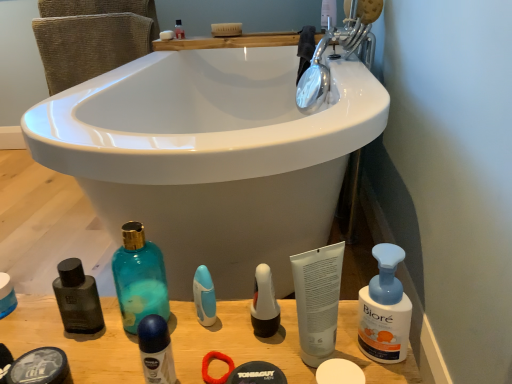
At what (x,y) coordinates should I click in order to perform the action: click on unoccupied region to the right of teal glass bottle at lower left, the first cleaning product viewed from the left. Please return your answer as a coordinate pair (x, y). The height and width of the screenshot is (384, 512). Looking at the image, I should click on (230, 331).